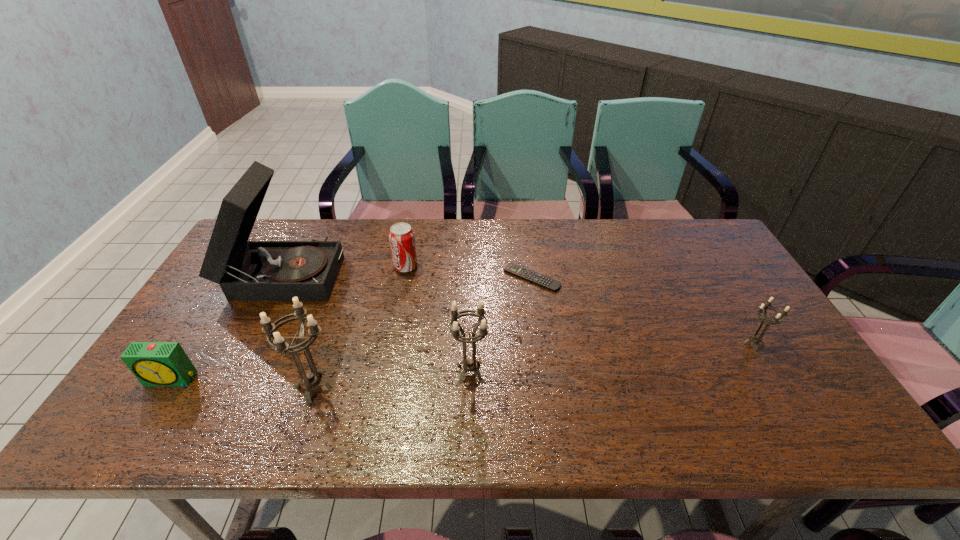
This screenshot has width=960, height=540. What are the coordinates of `alarm clock located in the left edge section of the desktop` in the screenshot? It's located at (153, 363).

Locate an element on the screen. object situated at the right edge is located at coordinates (756, 339).

At what (x,y) coordinates should I click in order to perform the action: click on object that is at the far left corner. Please return your answer as a coordinate pair (x, y). The image size is (960, 540). Looking at the image, I should click on (246, 270).

Find the location of `object situated at the near left corner`. object situated at the near left corner is located at coordinates (153, 363).

Where is `free space at the far edge of the desktop`? free space at the far edge of the desktop is located at coordinates (662, 235).

In the image, there is a desktop. Where is `blank space at the near edge`? This screenshot has width=960, height=540. blank space at the near edge is located at coordinates (695, 403).

This screenshot has height=540, width=960. Identify the location of blank space at the left edge. (251, 307).

The image size is (960, 540). Identify the location of free space at the right edge of the desktop. pyautogui.click(x=805, y=364).

The width and height of the screenshot is (960, 540). What are the coordinates of `vacant space at the near left corner of the desktop` in the screenshot? It's located at (207, 376).

Where is `free space at the far right corner of the desktop`? This screenshot has width=960, height=540. free space at the far right corner of the desktop is located at coordinates (704, 252).